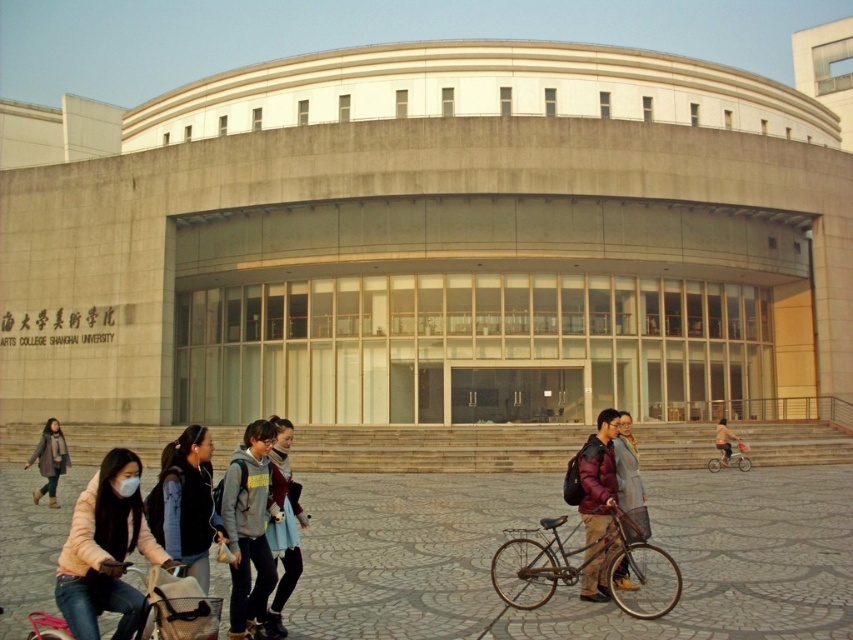
Question: Which of the following is the closest to the observer?

Choices:
 (A) light blue fabric coat at center
 (B) peachy fleece jacket at lower left
 (C) metallic silver bicycle at lower right
 (D) rusty metal bicycle at lower center

Answer: (B)

Question: Is rusty metal bicycle at lower center smaller than light blue fabric coat at center?

Choices:
 (A) yes
 (B) no

Answer: (A)

Question: Is gray hoodie at center further to the viewer compared to metallic silver bicycle at lower right?

Choices:
 (A) no
 (B) yes

Answer: (A)

Question: Which point is closer to the camera taking this photo?

Choices:
 (A) (727, 452)
 (B) (612, 490)
 (C) (64, 600)
 (D) (171, 461)

Answer: (C)

Question: Which point is farther to the camera?

Choices:
 (A) dark brown leather jacket at lower right
 (B) light blue fabric coat at center
 (C) maroon synthetic jacket at center
 (D) gray hoodie at center

Answer: (A)

Question: Is the position of peachy fleece jacket at lower left less distant than that of rusty metal bicycle at lower center?

Choices:
 (A) yes
 (B) no

Answer: (A)